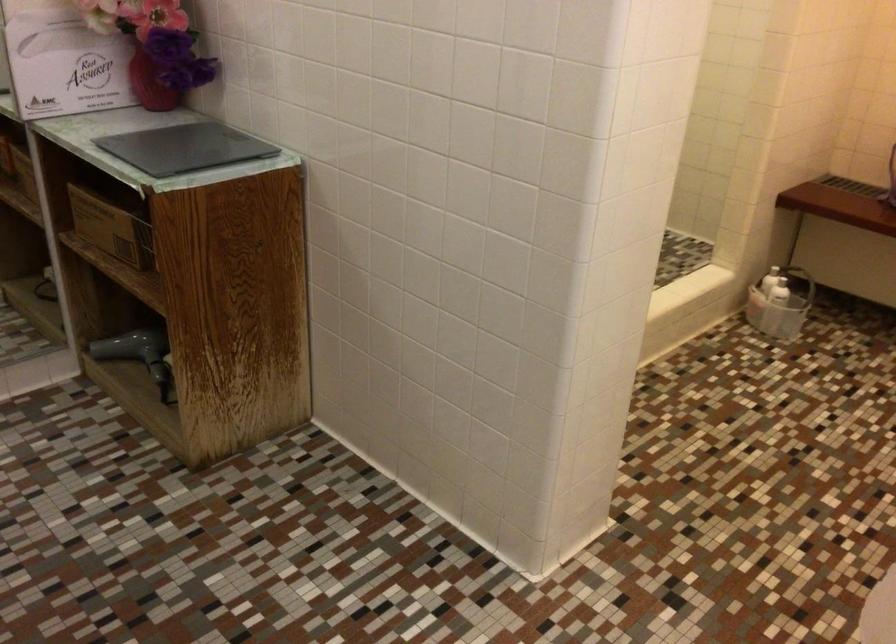
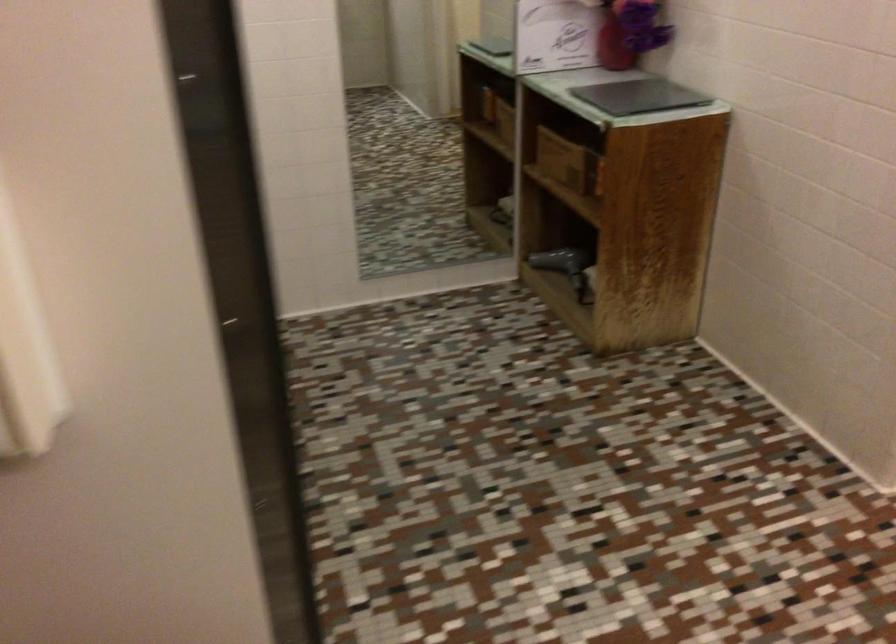
Locate, in the second image, the point that corresponds to pixel 141 352 in the first image.

(564, 266)